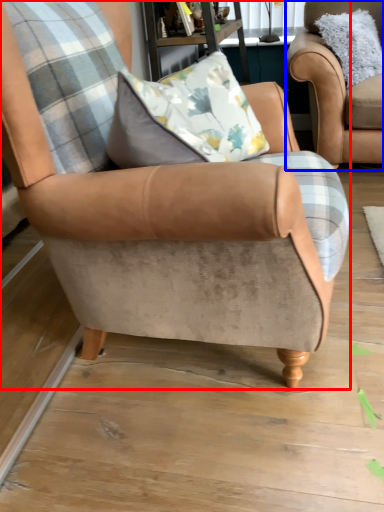
Question: Among these objects, which one is nearest to the camera, chair (highlighted by a red box) or chair (highlighted by a blue box)?

Choices:
 (A) chair
 (B) chair

Answer: (A)